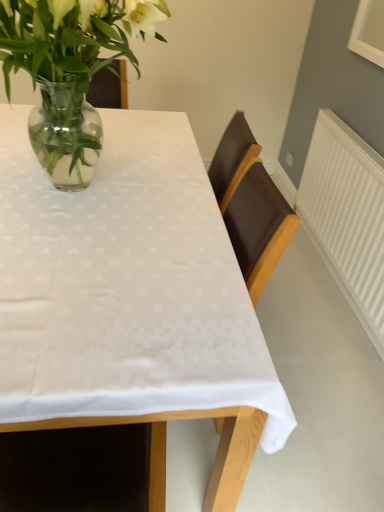
Identify the location of free spot below clear glass vase at upper left (from a real-world perspective). (87, 179).